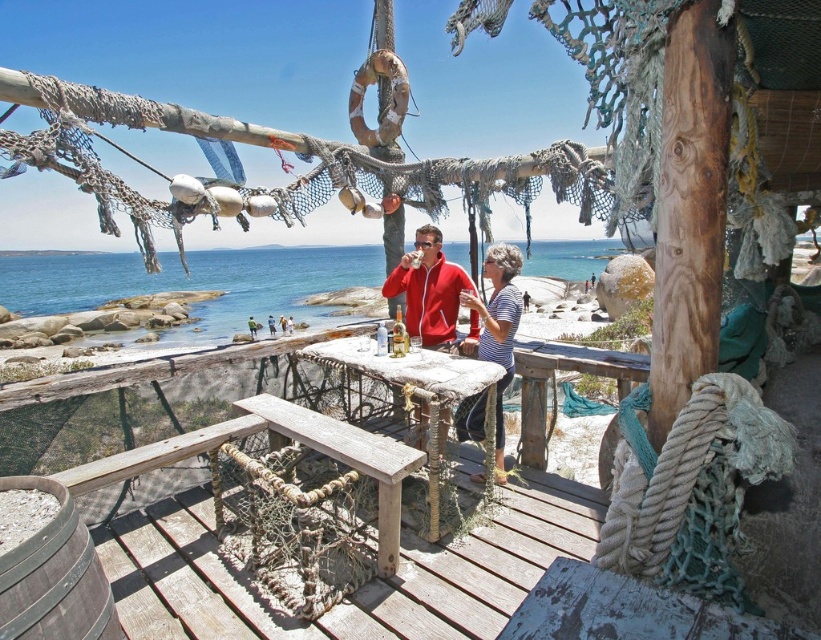
You are standing at the edge of the wooden deck looking towards the table. There are two points marked on the table surface. Which point, point (511, 288) or point (531, 426), is closer to you?

Point (511, 288) is closer to the camera than point (531, 426), so the point closer to you is point (511, 288).